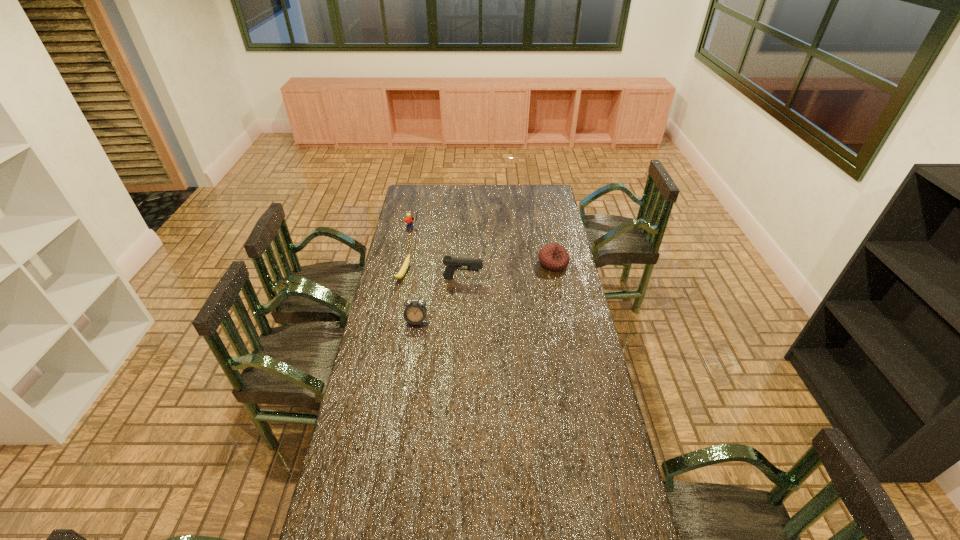
Locate an element on the screen. The width and height of the screenshot is (960, 540). free space that is in between the rightmost object and the Lego is located at coordinates (483, 246).

This screenshot has width=960, height=540. Find the location of `free space between the pistol and the nearest object`. free space between the pistol and the nearest object is located at coordinates (440, 300).

Identify the location of free space between the farthest object and the banana. tap(408, 251).

This screenshot has width=960, height=540. In order to click on free space that is in between the shortest object and the third object from right to left in this screenshot , I will do `click(410, 298)`.

I want to click on object that is the closest to the Lego, so click(x=401, y=273).

I want to click on the closest object to the alarm clock, so click(x=401, y=273).